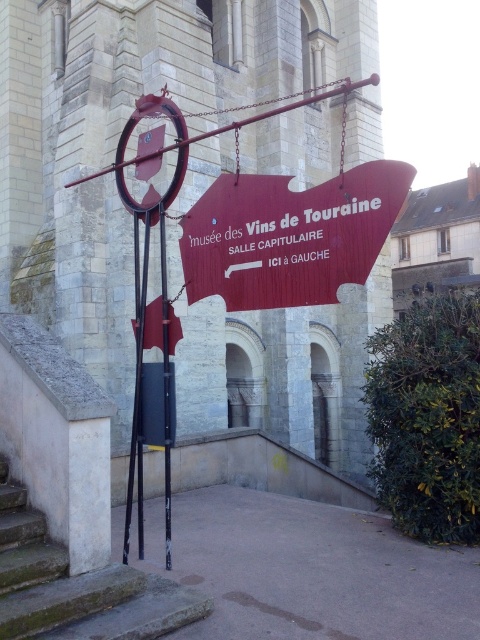
Question: Considering the relative positions of red matte sign at center and concrete stairs at lower left in the image provided, where is red matte sign at center located with respect to concrete stairs at lower left?

Choices:
 (A) above
 (B) below

Answer: (A)

Question: Is matte stone church at center above metallic pole at center?

Choices:
 (A) no
 (B) yes

Answer: (B)

Question: Which point is closer to the camera taking this photo?

Choices:
 (A) (290, 218)
 (B) (2, 486)

Answer: (A)

Question: Which of the following is the farthest from the observer?

Choices:
 (A) (229, 202)
 (B) (19, 618)

Answer: (A)

Question: Which point is closer to the camera taking this photo?

Choices:
 (A) (62, 602)
 (B) (115, 394)
 (C) (267, 179)
 (D) (164, 365)

Answer: (A)

Question: Can you confirm if matte stone church at center is wider than metallic pole at center?

Choices:
 (A) no
 (B) yes

Answer: (B)